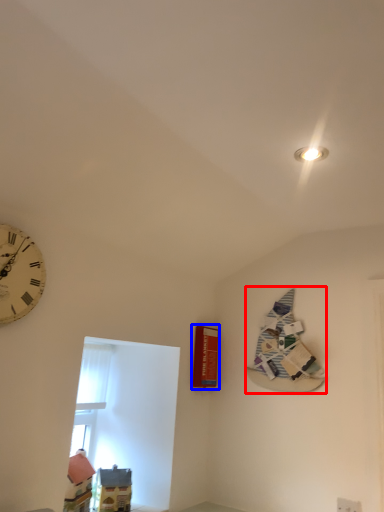
Question: Which of the following is the farthest to the observer, book (highlighted by a red box) or magazine (highlighted by a blue box)?

Choices:
 (A) book
 (B) magazine

Answer: (B)